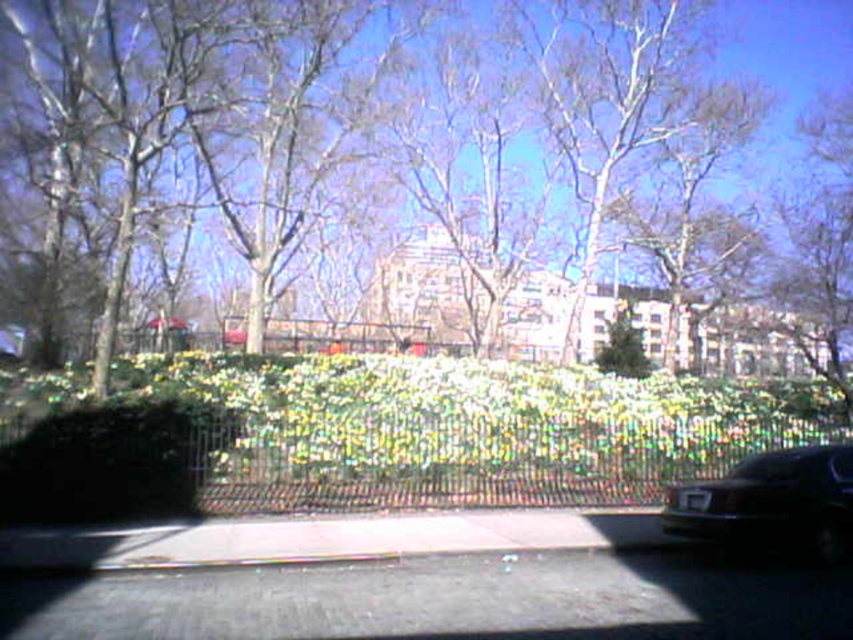
Question: Which object is positioned farthest from the green leafy bush at center?

Choices:
 (A) smooth bark tree at center
 (B) shiny black car at lower right
 (C) black metal fence at center

Answer: (A)

Question: From the image, what is the correct spatial relationship of black metal fence at center in relation to green leafy bush at center?

Choices:
 (A) right
 (B) left

Answer: (B)

Question: Which object is the closest to the smooth bark tree at center?

Choices:
 (A) shiny black car at lower right
 (B) green leafy bush at center
 (C) black metal fence at center

Answer: (C)

Question: In this image, where is shiny black car at lower right located relative to green leafy bush at center?

Choices:
 (A) right
 (B) left

Answer: (B)

Question: Among these points, which one is farthest from the camera?

Choices:
 (A) (743, 465)
 (B) (625, 436)
 (C) (614, 333)

Answer: (C)

Question: Is smooth bark tree at center above shiny black car at lower right?

Choices:
 (A) yes
 (B) no

Answer: (A)